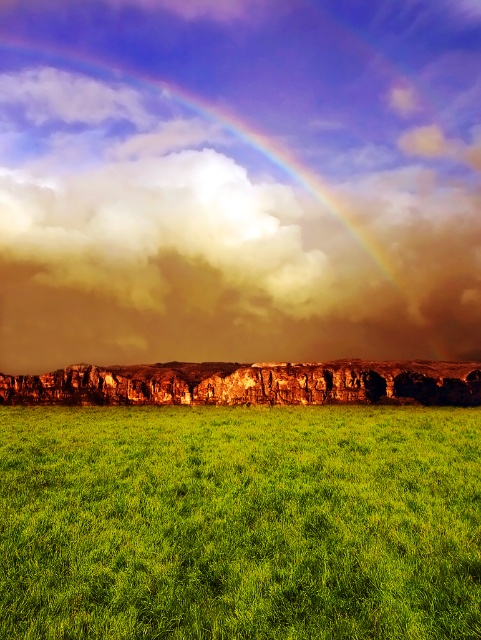
Question: Which of the following is the farthest from the observer?

Choices:
 (A) (361, 548)
 (B) (177, 177)

Answer: (B)

Question: Is cloudymaterial/texture at upper center below green grassy field at center?

Choices:
 (A) no
 (B) yes

Answer: (A)

Question: Which point appears farthest from the camera in this image?

Choices:
 (A) (39, 602)
 (B) (165, 275)

Answer: (B)

Question: Which of the following is the closest to the observer?

Choices:
 (A) cloudymaterial/texture at upper center
 (B) green grassy field at center

Answer: (B)

Question: Does cloudymaterial/texture at upper center appear over green grassy field at center?

Choices:
 (A) no
 (B) yes

Answer: (B)

Question: Is cloudymaterial/texture at upper center below green grassy field at center?

Choices:
 (A) yes
 (B) no

Answer: (B)